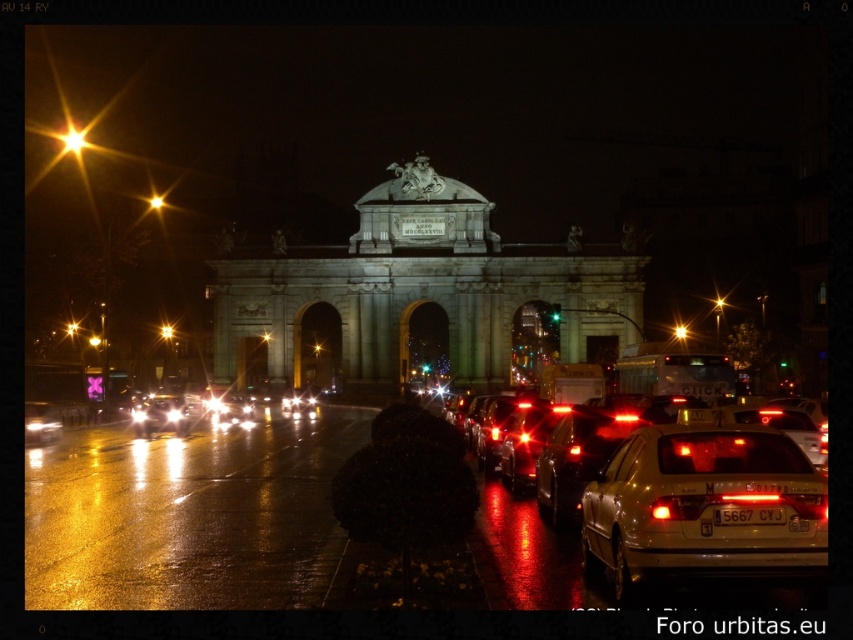
You are standing at the base of the historical archway and want to reach a specific point marked at coordinates point [57,420]. Given that the average walking distance per minute for an adult is 90 feet, how many minutes would it approximately take to reach that point?

The point [57,420] is 543.78 feet away from the viewer. At a walking pace of 90 feet per minute, it would take approximately 6 minutes to reach the point since 543.78 divided by 90 is approximately 6.04 minutes.